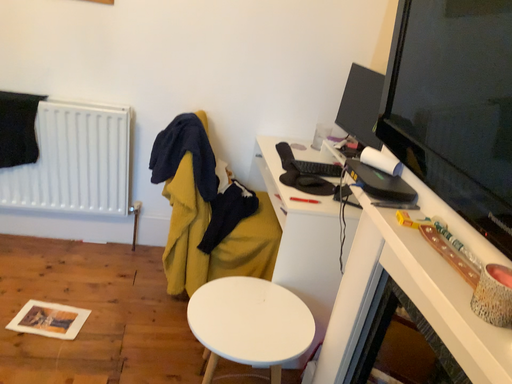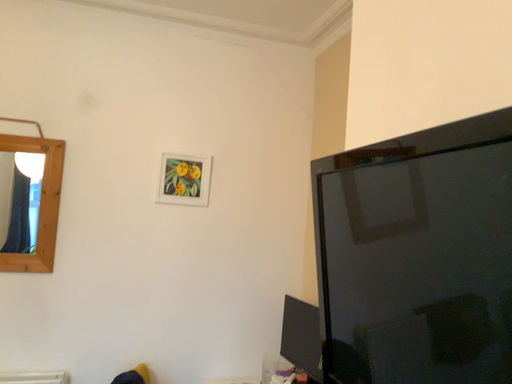
Question: How did the camera likely rotate when shooting the video?

Choices:
 (A) rotated right
 (B) rotated left

Answer: (A)